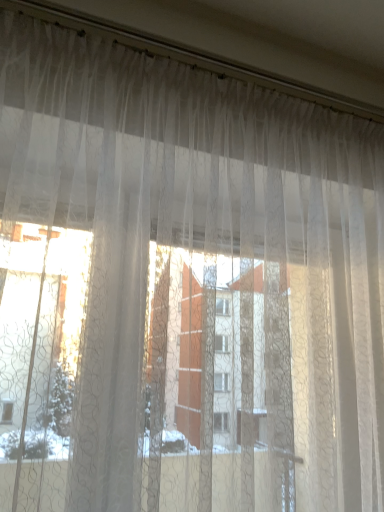
The width and height of the screenshot is (384, 512). What do you see at coordinates (156, 132) in the screenshot?
I see `translucent white curtain at upper center` at bounding box center [156, 132].

At what (x,y) coordinates should I click in order to perform the action: click on translucent white curtain at upper center. Please return your answer as a coordinate pair (x, y). Looking at the image, I should click on (156, 132).

What is the approximate height of translucent white curtain at upper center?

It is 2.07 inches.

Locate an element on the screen. This screenshot has width=384, height=512. translucent white curtain at upper center is located at coordinates (156, 132).